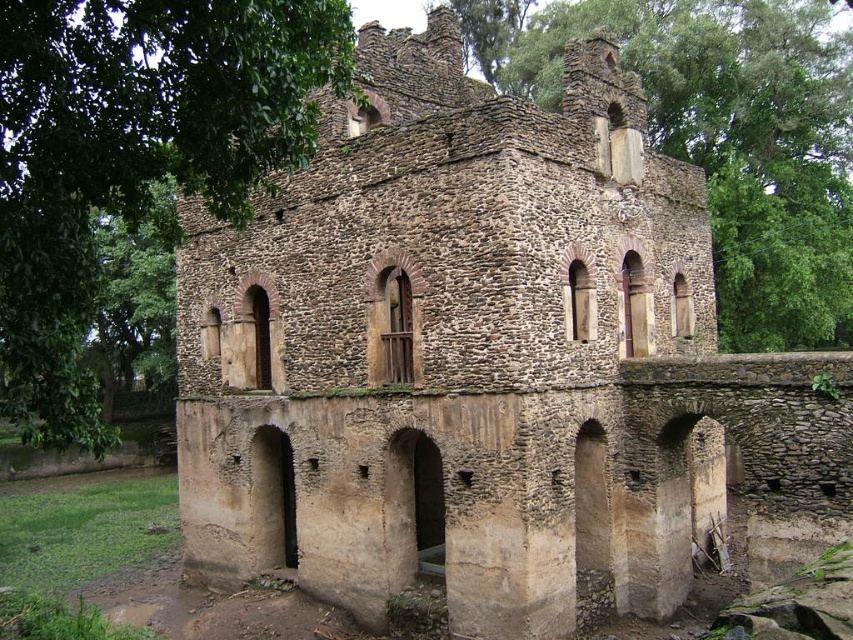
Question: Can you confirm if green leafy tree at left is positioned to the left of green leafy tree at upper center?

Choices:
 (A) no
 (B) yes

Answer: (B)

Question: Considering the relative positions of green leafy tree at left and green leafy tree at upper center in the image provided, where is green leafy tree at left located with respect to green leafy tree at upper center?

Choices:
 (A) left
 (B) right

Answer: (A)

Question: Which of the following is the farthest from the observer?

Choices:
 (A) green leafy tree at left
 (B) green leafy tree at upper center

Answer: (B)

Question: Among these points, which one is nearest to the camera?

Choices:
 (A) (171, 65)
 (B) (792, 330)

Answer: (A)

Question: Can you confirm if green leafy tree at left is smaller than green leafy tree at upper center?

Choices:
 (A) no
 (B) yes

Answer: (A)

Question: Which object is closer to the camera taking this photo?

Choices:
 (A) green leafy tree at upper center
 (B) green leafy tree at left

Answer: (B)